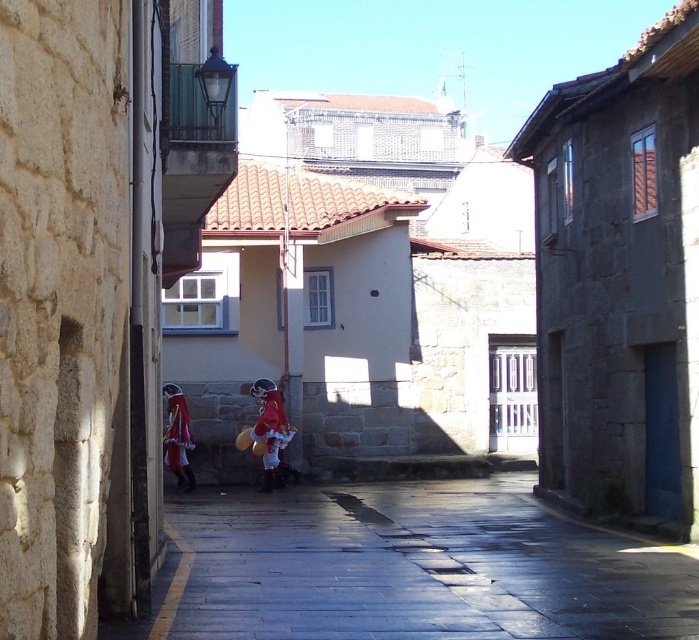
Based on the photo, you are standing on the narrow street in the historic European town. You see two points marked on the ground. The first point is at coordinates point (x=264, y=456) and the second point is at coordinates point (x=172, y=388). Which point is closer to you?

Point (x=264, y=456) is in front of point (x=172, y=388), so it is closer to you.

You are a tourist standing in the middle of the narrow street. You notice a velvet red cape at center and a smooth stone pavement at center. Which object is positioned to the right of the other?

The smooth stone pavement at center is to the right of the velvet red cape at center.

You are a tourist visiting this historic town and see the red velvet santa claus at center and the velvet red cape at center in the street. Which object is located underneath the other?

The red velvet santa claus at center is positioned under the velvet red cape at center.